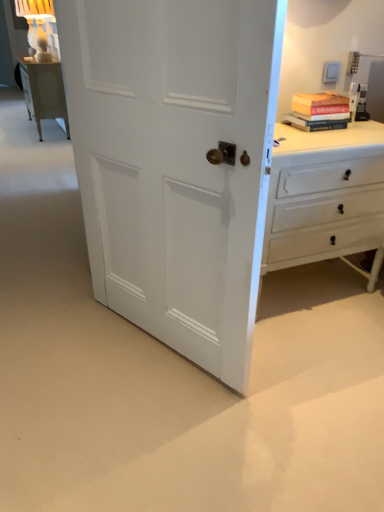
Question: Is white painted wood chest of drawers at right further to the viewer compared to white painted wood door at center?

Choices:
 (A) no
 (B) yes

Answer: (B)

Question: Does white painted wood chest of drawers at right appear on the right side of white painted wood door at center?

Choices:
 (A) yes
 (B) no

Answer: (A)

Question: Does white painted wood chest of drawers at right have a lesser width compared to white painted wood door at center?

Choices:
 (A) no
 (B) yes

Answer: (A)

Question: Is white painted wood chest of drawers at right bigger than white painted wood door at center?

Choices:
 (A) no
 (B) yes

Answer: (B)

Question: Considering the relative sizes of white painted wood chest of drawers at right and white painted wood door at center in the image provided, is white painted wood chest of drawers at right shorter than white painted wood door at center?

Choices:
 (A) no
 (B) yes

Answer: (B)

Question: From the image's perspective, is white painted wood door at center positioned above or below hardcover book at upper right?

Choices:
 (A) above
 (B) below

Answer: (B)

Question: Do you think white painted wood door at center is within hardcover book at upper right, or outside of it?

Choices:
 (A) inside
 (B) outside

Answer: (B)

Question: Is point (145, 243) closer or farther from the camera than point (304, 108)?

Choices:
 (A) farther
 (B) closer

Answer: (B)

Question: In the image, is white painted wood door at center positioned in front of or behind hardcover book at upper right?

Choices:
 (A) front
 (B) behind

Answer: (A)

Question: From a real-world perspective, is white painted wood chest of drawers at right positioned above or below hardcover book at upper right?

Choices:
 (A) below
 (B) above

Answer: (A)

Question: In terms of size, does white painted wood chest of drawers at right appear bigger or smaller than hardcover book at upper right?

Choices:
 (A) big
 (B) small

Answer: (A)

Question: Is white painted wood chest of drawers at right in front of or behind hardcover book at upper right in the image?

Choices:
 (A) behind
 (B) front

Answer: (B)

Question: Based on their positions, is white painted wood chest of drawers at right located to the left or right of hardcover book at upper right?

Choices:
 (A) left
 (B) right

Answer: (A)

Question: Considering the positions of hardcover book at upper right and white painted wood chest of drawers at right in the image, is hardcover book at upper right wider or thinner than white painted wood chest of drawers at right?

Choices:
 (A) thin
 (B) wide

Answer: (A)

Question: From the image's perspective, is hardcover book at upper right above or below white painted wood chest of drawers at right?

Choices:
 (A) above
 (B) below

Answer: (A)